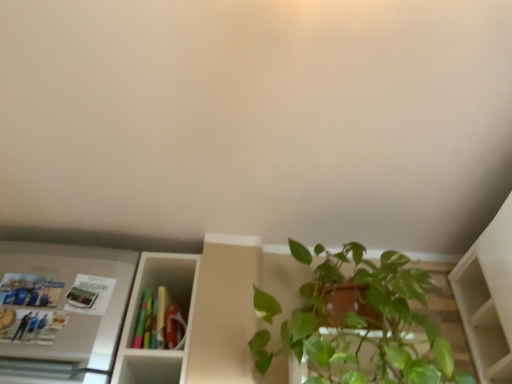
Describe the element at coordinates (159, 322) in the screenshot. I see `matte plastic book at center` at that location.

Locate an element on the screen. The image size is (512, 384). green glossy plant at lower right is located at coordinates (362, 324).

Consider the image. From a real-world perspective, is metallic silver fridge at left located higher than green glossy plant at lower right?

Indeed, from a real-world perspective, metallic silver fridge at left stands above green glossy plant at lower right.

Is metallic silver fridge at left directly adjacent to green glossy plant at lower right?

No, metallic silver fridge at left is not touching green glossy plant at lower right.

In the scene shown: Considering the sizes of objects metallic silver fridge at left and green glossy plant at lower right in the image provided, who is wider, metallic silver fridge at left or green glossy plant at lower right?

green glossy plant at lower right.

How different are the orientations of metallic silver fridge at left and green glossy plant at lower right in degrees?

metallic silver fridge at left and green glossy plant at lower right are facing 3 degrees away from each other.

Looking at this image, choose the correct answer: Is matte plastic book at center inside green glossy plant at lower right or outside it?

matte plastic book at center is outside green glossy plant at lower right.

Where is `book on the left of the green glossy plant at lower right`? Image resolution: width=512 pixels, height=384 pixels. book on the left of the green glossy plant at lower right is located at coordinates (159, 322).

Is matte plastic book at center aimed at green glossy plant at lower right?

No.

Looking at this image, would you say green glossy plant at lower right is outside metallic silver fridge at left?

Indeed, green glossy plant at lower right is completely outside metallic silver fridge at left.

In the image, is green glossy plant at lower right on the left side or the right side of metallic silver fridge at left?

Based on their positions, green glossy plant at lower right is located to the right of metallic silver fridge at left.

Which is farther, (330, 311) or (97, 368)?

Point (97, 368)

From a real-world perspective, is green glossy plant at lower right physically below metallic silver fridge at left?

Yes, from a real-world perspective, green glossy plant at lower right is below metallic silver fridge at left.

Measure the distance from metallic silver fridge at left to matte plastic book at center.

They are 8.12 inches apart.

Consider the image. Is metallic silver fridge at left positioned behind matte plastic book at center?

No, metallic silver fridge at left is in front of matte plastic book at center.

Is matte plastic book at center inside metallic silver fridge at left?

No, matte plastic book at center is not inside metallic silver fridge at left.

How many degrees apart are the facing directions of metallic silver fridge at left and matte plastic book at center?

3 degrees.

Does green glossy plant at lower right touch matte plastic book at center?

green glossy plant at lower right is not next to matte plastic book at center, and they're not touching.

Is point (310, 295) positioned before point (170, 309)?

Yes.

From a real-world perspective, is green glossy plant at lower right located higher than matte plastic book at center?

Incorrect, from a real-world perspective, green glossy plant at lower right is lower than matte plastic book at center.

From the image's perspective, between green glossy plant at lower right and matte plastic book at center, which one is located above?

green glossy plant at lower right.

Is matte plastic book at center at the left side of metallic silver fridge at left?

In fact, matte plastic book at center is to the right of metallic silver fridge at left.

Can you tell me how much matte plastic book at center and metallic silver fridge at left differ in facing direction?

The angle between the facing direction of matte plastic book at center and the facing direction of metallic silver fridge at left is 3 degrees.

Based on the photo, how much distance is there between matte plastic book at center and metallic silver fridge at left?

matte plastic book at center and metallic silver fridge at left are 8.12 inches apart from each other.

Where is `appliance that is in front of the matte plastic book at center`? The image size is (512, 384). appliance that is in front of the matte plastic book at center is located at coordinates (61, 311).

Image resolution: width=512 pixels, height=384 pixels. What are the coordinates of `houseplant that is in front of the metallic silver fridge at left` in the screenshot? It's located at (362, 324).

Image resolution: width=512 pixels, height=384 pixels. I want to click on book that appears on the left of green glossy plant at lower right, so click(159, 322).

Looking at the image, which one is located further to green glossy plant at lower right, metallic silver fridge at left or matte plastic book at center?

metallic silver fridge at left.

When comparing their distances from metallic silver fridge at left, does matte plastic book at center or green glossy plant at lower right seem further?

green glossy plant at lower right.

Based on their spatial positions, is green glossy plant at lower right or metallic silver fridge at left closer to matte plastic book at center?

metallic silver fridge at left lies closer to matte plastic book at center than the other object.

From the image, which object appears to be farther from metallic silver fridge at left, green glossy plant at lower right or matte plastic book at center?

Among the two, green glossy plant at lower right is located further to metallic silver fridge at left.

Based on their spatial positions, is matte plastic book at center or metallic silver fridge at left further from green glossy plant at lower right?

Based on the image, metallic silver fridge at left appears to be further to green glossy plant at lower right.

Which object lies further to the anchor point matte plastic book at center, metallic silver fridge at left or green glossy plant at lower right?

Among the two, green glossy plant at lower right is located further to matte plastic book at center.

You are a GUI agent. You are given a task and a screenshot of the screen. Output one action in this format:
    pyautogui.click(x=<x>, y=<y>)
    Task: Click on the book between metallic silver fridge at left and green glossy plant at lower right
    This screenshot has width=512, height=384.
    Given the screenshot: What is the action you would take?
    pyautogui.click(x=159, y=322)